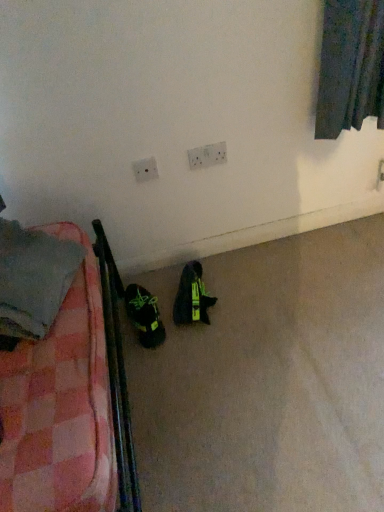
Locate an element on the screen. This screenshot has width=384, height=512. vacant area that is in front of green matte sneakers at lower left, positioned as the first footwear in left-to-right order is located at coordinates (153, 364).